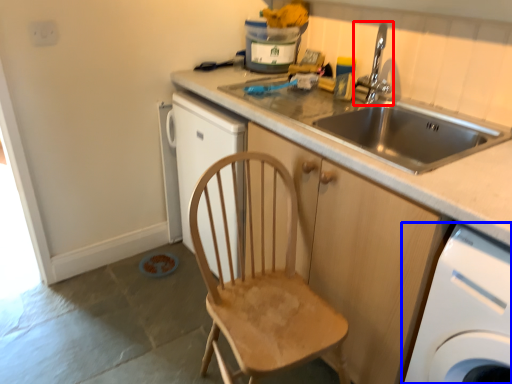
Question: Among these objects, which one is nearest to the camera, tap (highlighted by a red box) or home appliance (highlighted by a blue box)?

Choices:
 (A) tap
 (B) home appliance

Answer: (B)